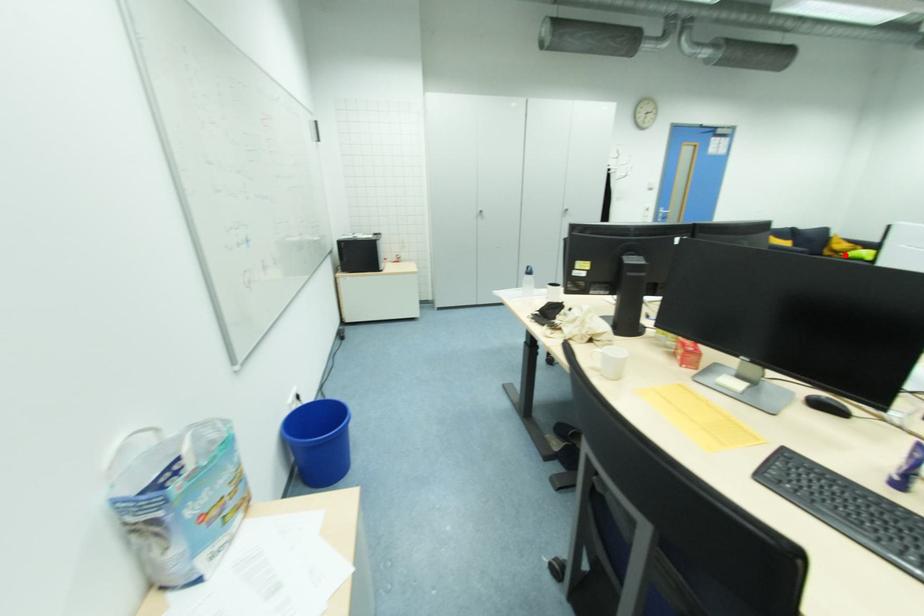
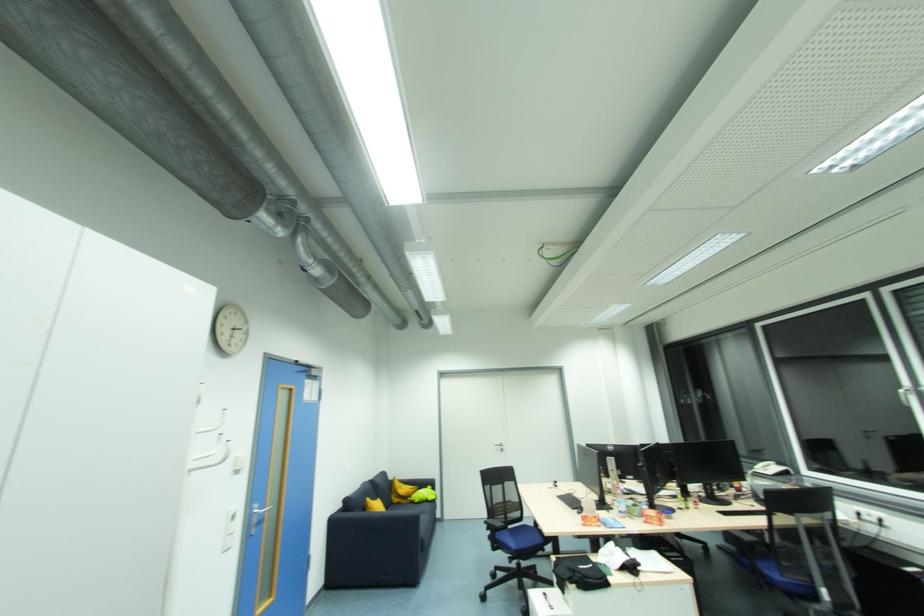
Locate, in the second image, the point that corresponds to the highlighted location in the first image.

(412, 499)